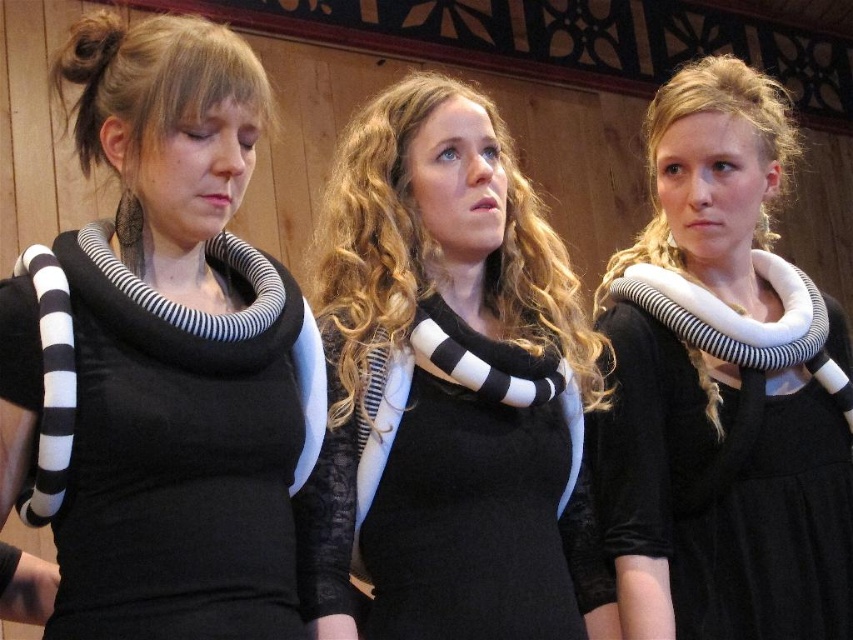
From the picture: You are a photographer standing in front of the three people. You want to take a closeup photo of the black matte scarf at left without including the other two people. Can you step forward enough to do so?

The black matte scarf at left and viewer are 1.13 meters apart. Since you can step forward to get closer, you can take the closeup photo without including the others as long as you are within that distance.

Looking at this image, you are a photographer preparing to take a group photo of the three people in the scene. You need to ensure that the black matte scarf at left and the black and white striped scarf at center are clearly visible in the photo. Given that your camera has a minimum focus distance of 12 inches, will you be able to focus on both scarves simultaneously?

The black matte scarf at left is 11.35 inches from the black and white striped scarf at center. Since the distance between them is less than the camera minimum focus distance of 12 inches, the camera cannot focus on both scarves at the same time.

You are an event planner arranging a photo shoot in the described scene. You need to place a decorative stand at coordinates point A. The stand will be placed at the same horizontal level as the black matte scarf at left but 0.1 units to the right. What are the coordinates of point A?

The coordinates of point A are calculated by keeping the same y value as the black matte scarf at left and adding 0.1 to the x coordinate. The original coordinates are x 0.558 and y 0.190. Adding 0.1 to the x gives 0.658. Thus, point A is at (161, 420).